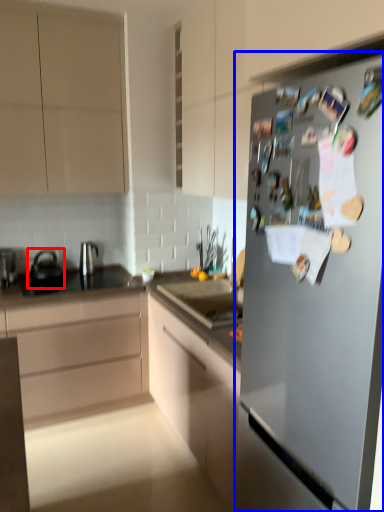
Question: Which point is further to the camera, tea pot (highlighted by a red box) or refrigerator (highlighted by a blue box)?

Choices:
 (A) tea pot
 (B) refrigerator

Answer: (A)